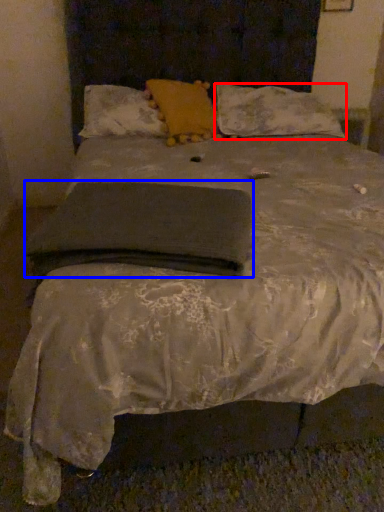
Question: Which point is closer to the camera, pillow (highlighted by a red box) or pad (highlighted by a blue box)?

Choices:
 (A) pillow
 (B) pad

Answer: (B)